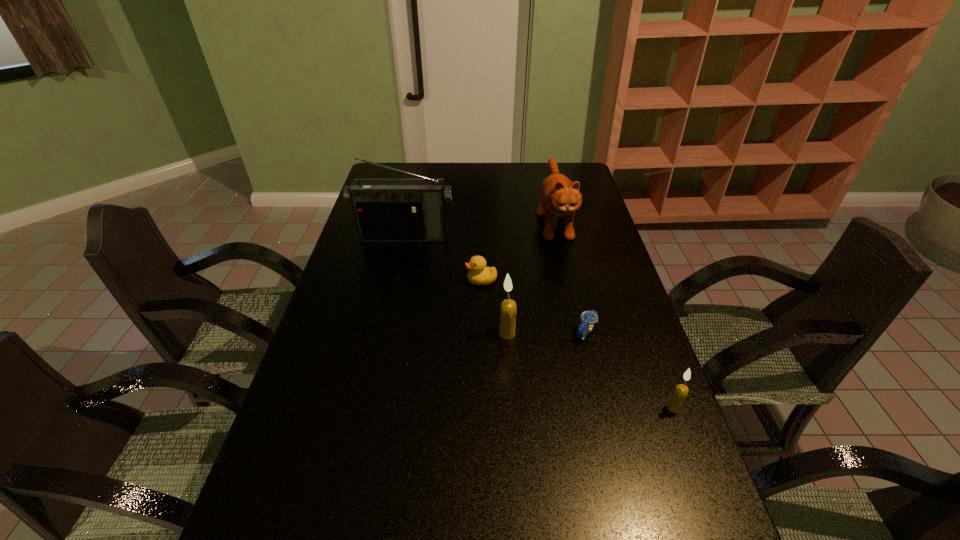
At what (x,y) coordinates should I click in order to perform the action: click on cat that is at the right edge. Please return your answer as a coordinate pair (x, y). This screenshot has width=960, height=540. Looking at the image, I should click on (559, 196).

At what (x,y) coordinates should I click in order to perform the action: click on watch that is positioned at the right edge. Please return your answer as a coordinate pair (x, y). The width and height of the screenshot is (960, 540). Looking at the image, I should click on (588, 318).

Where is `vacant space at the far edge of the desktop`? Image resolution: width=960 pixels, height=540 pixels. vacant space at the far edge of the desktop is located at coordinates (480, 183).

Locate an element on the screen. free space at the near edge of the desktop is located at coordinates (469, 492).

This screenshot has width=960, height=540. In the image, there is a desktop. Find the location of `free space at the left edge`. free space at the left edge is located at coordinates (316, 470).

Identify the location of vacant space at the right edge. (585, 249).

Find the location of `free region at the far left corner of the desktop`. free region at the far left corner of the desktop is located at coordinates [x=392, y=162].

In the image, there is a desktop. Find the location of `free region at the far right corner`. free region at the far right corner is located at coordinates pos(546,171).

The width and height of the screenshot is (960, 540). Find the location of `free space between the shortest object and the cat`. free space between the shortest object and the cat is located at coordinates (570, 275).

Locate an element on the screen. The height and width of the screenshot is (540, 960). vacant area that lies between the shortest object and the left candle is located at coordinates (546, 333).